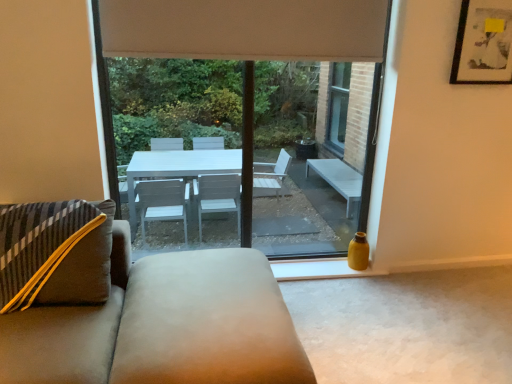
Locate an element on the screen. Image resolution: width=512 pixels, height=384 pixels. empty space that is ontop of suede ottoman at center (from a real-world perspective) is located at coordinates (202, 284).